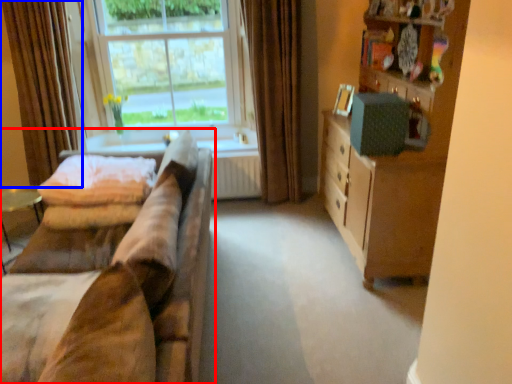
Question: Which point is further to the camera, studio couch (highlighted by a red box) or curtain (highlighted by a blue box)?

Choices:
 (A) studio couch
 (B) curtain

Answer: (B)